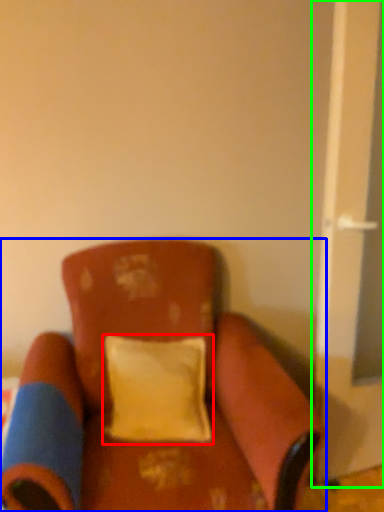
Question: Based on their relative distances, which object is nearer to pillow (highlighted by a red box)? Choose from chair (highlighted by a blue box) and screen door (highlighted by a green box).

Choices:
 (A) chair
 (B) screen door

Answer: (A)